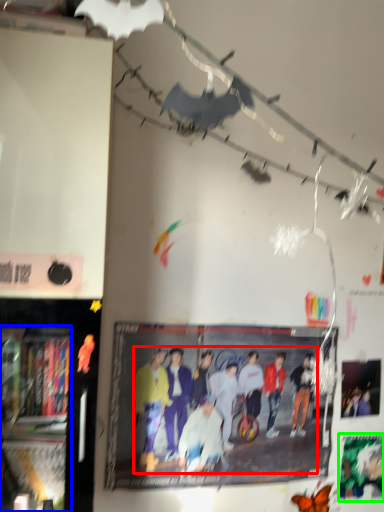
Question: Which object is positioned closest to person (highlighted by a red box)? Select from bookshelf (highlighted by a blue box) and poster page (highlighted by a green box).

Choices:
 (A) bookshelf
 (B) poster page

Answer: (A)